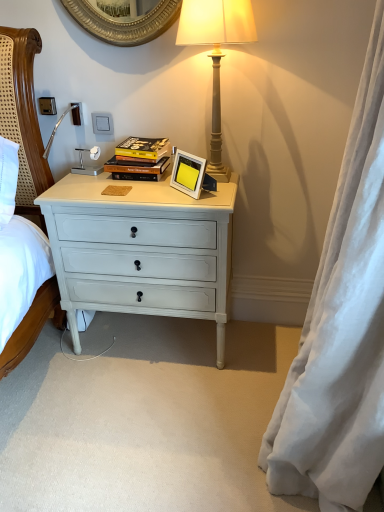
At what (x,y) coordinates should I click in order to perform the action: click on vacant area that is in front of hardcover book at center. Please return your answer as a coordinate pair (x, y). The width and height of the screenshot is (384, 512). Looking at the image, I should click on (140, 185).